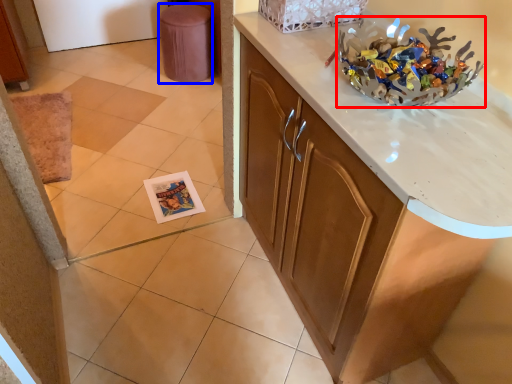
Question: Which of the following is the farthest to the observer, stuff (highlighted by a red box) or stool (highlighted by a blue box)?

Choices:
 (A) stuff
 (B) stool

Answer: (B)